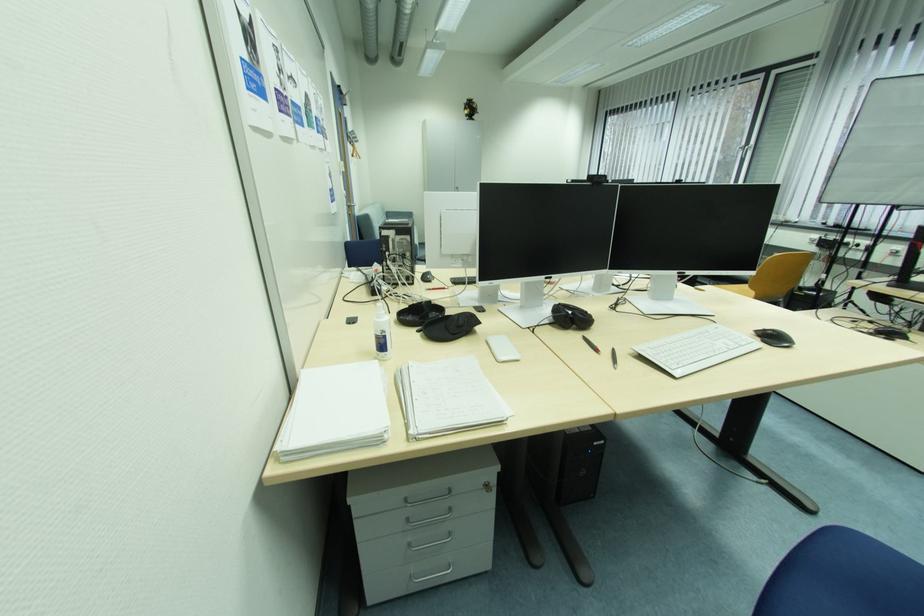
Find where to push the bottle pump. Please return your answer as a coordinate pair (x, y).

(380, 309)